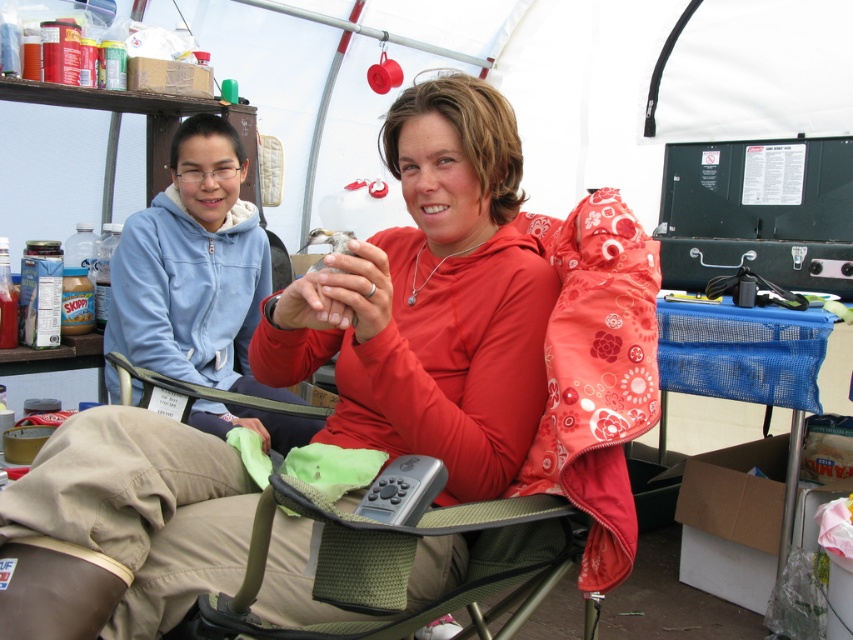
You are a photographer trying to capture a candid shot of the two people in the tent. You want to ensure that both the matte red shirt at center and the khaki fabric pants at lower center are clearly visible in the frame. Based on their positions, which object should you focus on first to ensure both are in focus?

The matte red shirt at center is positioned on the right side of khaki fabric pants at lower center. Therefore, focusing on the khaki fabric pants at lower center first will help ensure both objects remain in focus since it is closer to the camera.

You are taking a photo of the two people in the tent. You want to focus on the person holding the bird. Which point, point A at coordinates point (422, 369) or point B at coordinates point (325, 605), is closer to the camera and should be used for focus?

Point A at coordinates point (422, 369) is closer to the camera than point B at coordinates point (325, 605), so you should focus on point A to capture the person holding the bird clearly.